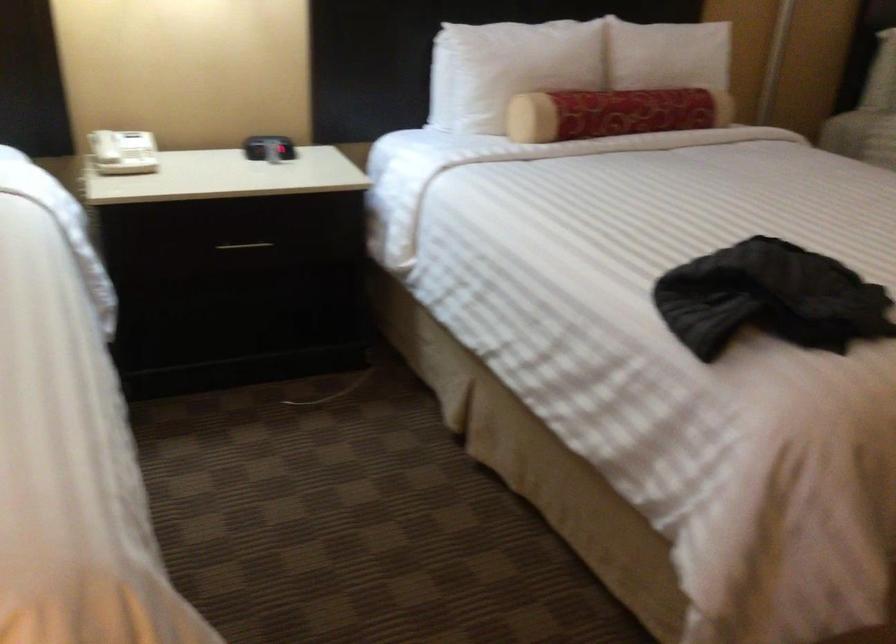
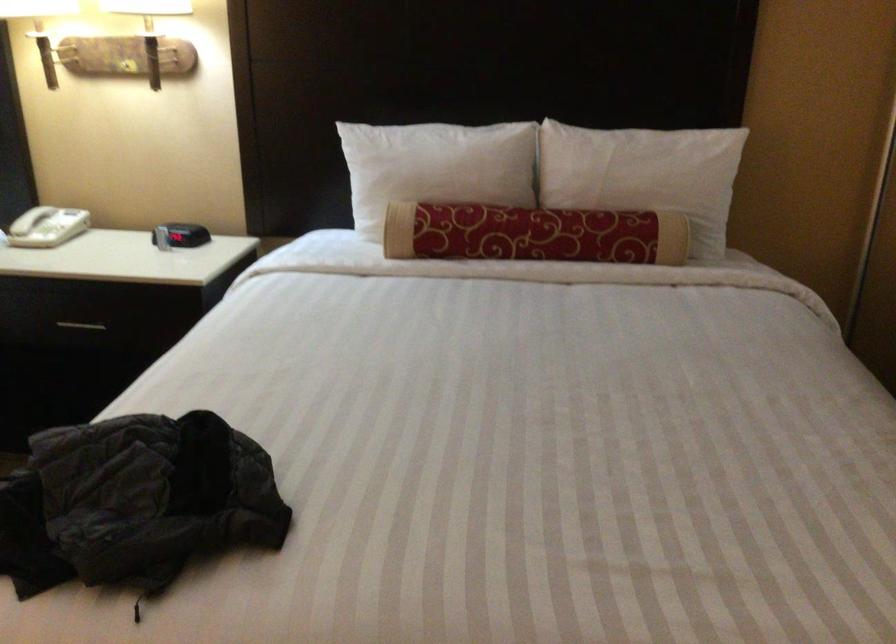
Where in the second image is the point corresponding to pixel 648 108 from the first image?

(533, 234)